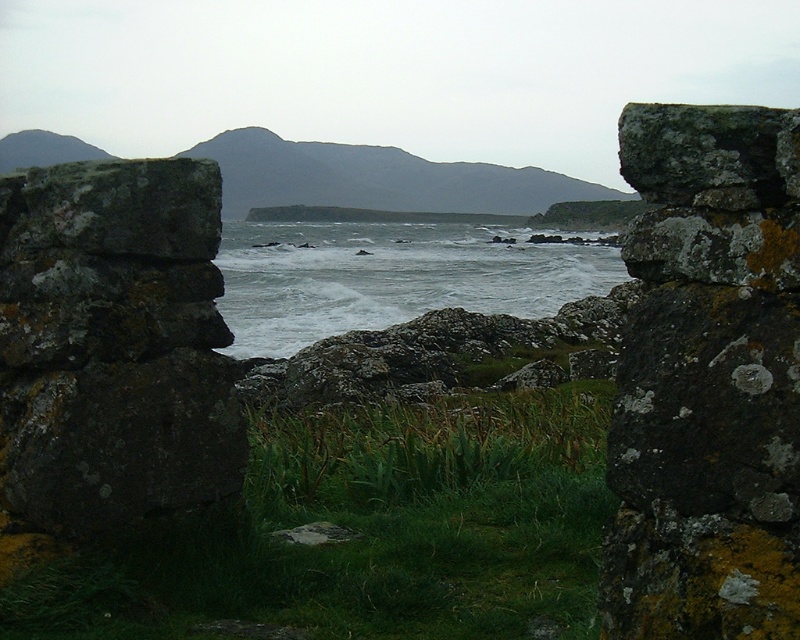
Question: Which object is the farthest from the green grassy patch at center?

Choices:
 (A) rusty stone wall at right
 (B) white frothy water at center
 (C) lichen-covered rock at upper right

Answer: (B)

Question: Can you confirm if green grassy patch at center is wider than white frothy water at center?

Choices:
 (A) no
 (B) yes

Answer: (A)

Question: Which of the following is the farthest from the observer?

Choices:
 (A) (404, 260)
 (B) (645, 116)
 (C) (409, 444)
 (D) (652, 406)

Answer: (A)

Question: Among these objects, which one is nearest to the camera?

Choices:
 (A) rusty stone wall at right
 (B) green grassy patch at center

Answer: (A)

Question: In this image, where is green grassy patch at center located relative to lichen-covered rock at upper right?

Choices:
 (A) left
 (B) right

Answer: (A)

Question: Is green grassy patch at center closer to camera compared to white frothy water at center?

Choices:
 (A) yes
 (B) no

Answer: (A)